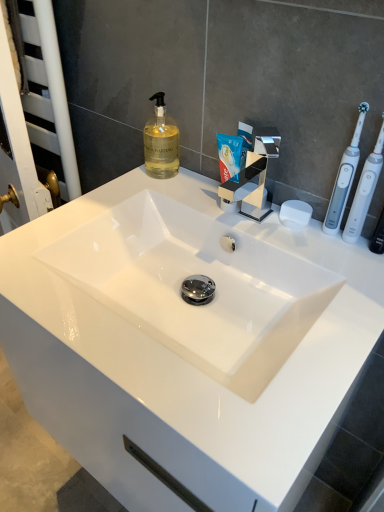
Question: Is white plastic toothbrush at right, the 1th toothbrush when ordered from left to right, thinner than chrome metallic tap at center?

Choices:
 (A) yes
 (B) no

Answer: (A)

Question: Can you confirm if white plastic toothbrush at right, the 1th toothbrush when ordered from left to right, is smaller than chrome metallic tap at center?

Choices:
 (A) yes
 (B) no

Answer: (A)

Question: Is white plastic toothbrush at right, the 2th toothbrush in the right-to-left sequence, oriented away from chrome metallic tap at center?

Choices:
 (A) yes
 (B) no

Answer: (B)

Question: From a real-world perspective, is white plastic toothbrush at right, the 2th toothbrush in the right-to-left sequence, beneath chrome metallic tap at center?

Choices:
 (A) yes
 (B) no

Answer: (B)

Question: Is white plastic toothbrush at right, the 1th toothbrush when ordered from left to right, further to camera compared to chrome metallic tap at center?

Choices:
 (A) no
 (B) yes

Answer: (A)

Question: Is white plastic toothbrush at right, the 1th toothbrush when ordered from left to right, at the left side of chrome metallic tap at center?

Choices:
 (A) yes
 (B) no

Answer: (B)

Question: From a real-world perspective, is translucent glass soap dispenser at upper center physically above white matte soap at right?

Choices:
 (A) yes
 (B) no

Answer: (A)

Question: Is translucent glass soap dispenser at upper center positioned with its back to white matte soap at right?

Choices:
 (A) no
 (B) yes

Answer: (A)

Question: From a real-world perspective, is translucent glass soap dispenser at upper center beneath white matte soap at right?

Choices:
 (A) no
 (B) yes

Answer: (A)

Question: Is translucent glass soap dispenser at upper center next to white matte soap at right and touching it?

Choices:
 (A) no
 (B) yes

Answer: (A)

Question: Does translucent glass soap dispenser at upper center appear on the right side of white matte soap at right?

Choices:
 (A) yes
 (B) no

Answer: (B)

Question: Can you confirm if translucent glass soap dispenser at upper center is wider than white matte soap at right?

Choices:
 (A) no
 (B) yes

Answer: (B)

Question: Is white plastic toothbrush at right, the 2th toothbrush in the right-to-left sequence, at the back of white plastic toothbrush at right, positioned as the second toothbrush in left-to-right order?

Choices:
 (A) no
 (B) yes

Answer: (A)